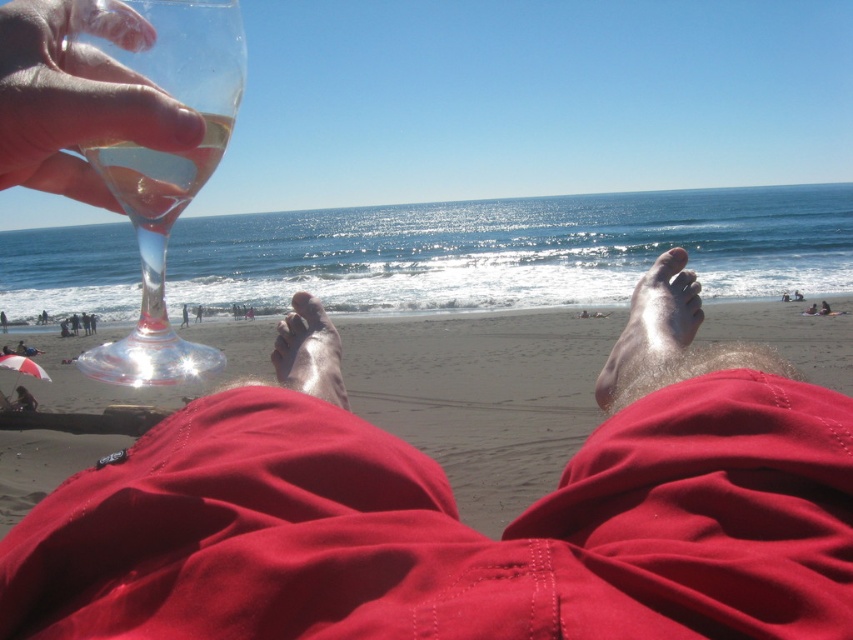
Which of these two, clear glass wine glass at upper left or clear glass wine at upper left, stands taller?

With more height is clear glass wine glass at upper left.

Is point (181, 42) more distant than point (164, 172)?

That is False.

Locate an element on the screen. The image size is (853, 640). clear glass wine glass at upper left is located at coordinates (163, 160).

Can you confirm if shiny skin foot at lower right is thinner than clear glass wine at upper left?

Incorrect, shiny skin foot at lower right's width is not less than clear glass wine at upper left's.

Describe the element at coordinates (651, 330) in the screenshot. I see `shiny skin foot at lower right` at that location.

Identify the location of shiny skin foot at lower right. (651, 330).

Consider the image. Is clear glass wine glass at upper left below shiny skin foot at lower right?

Actually, clear glass wine glass at upper left is above shiny skin foot at lower right.

Is clear glass wine glass at upper left smaller than shiny skin foot at lower right?

Actually, clear glass wine glass at upper left might be larger than shiny skin foot at lower right.

Is point (86, 358) positioned in front of point (680, 266)?

Yes, it is.

Where is `clear glass wine glass at upper left`? The height and width of the screenshot is (640, 853). clear glass wine glass at upper left is located at coordinates (163, 160).